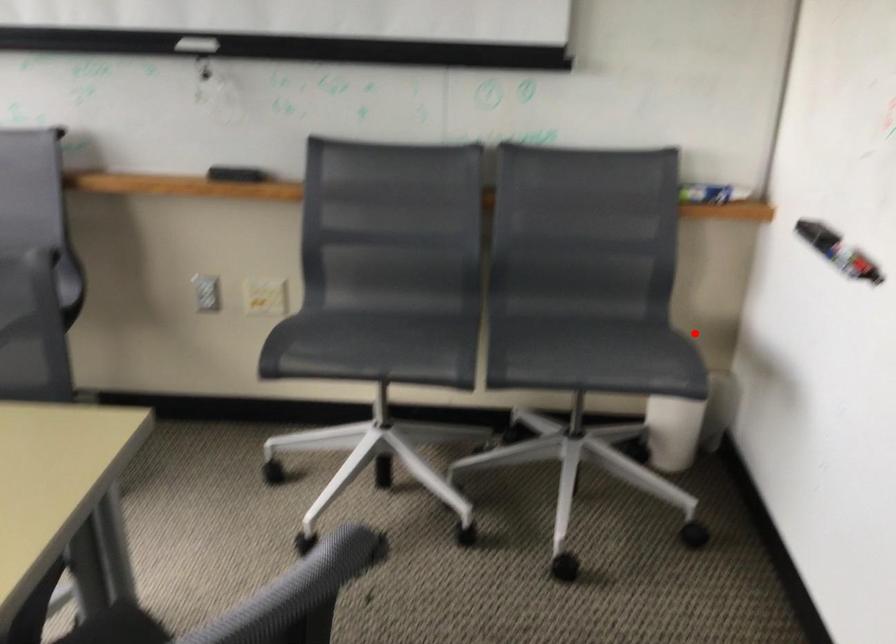
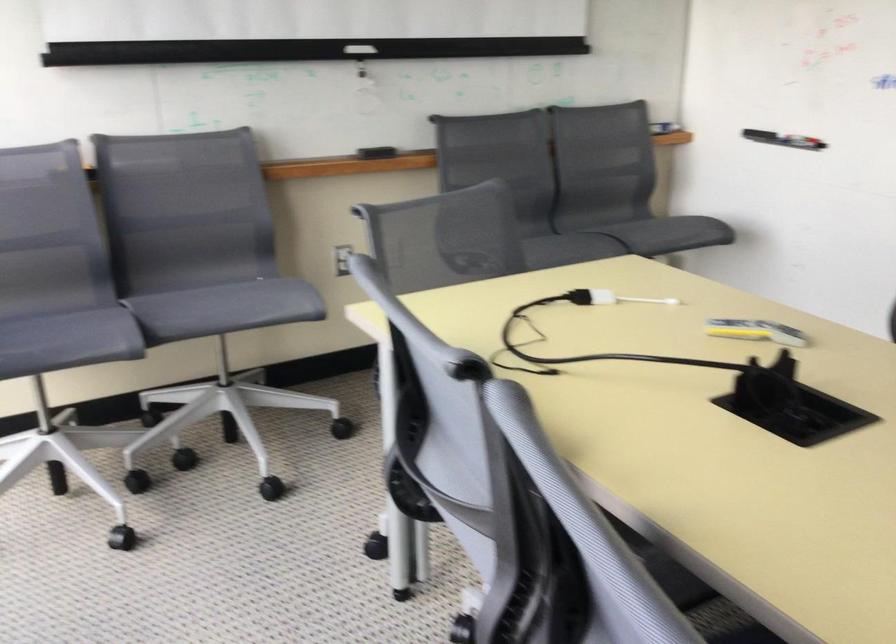
In the second image, find the point that corresponds to the highlighted location in the first image.

(657, 223)